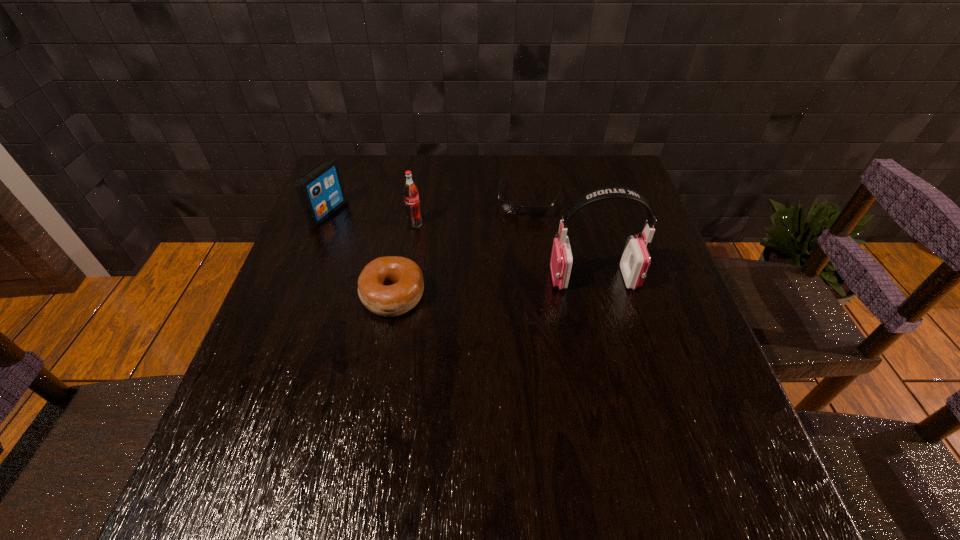
Identify which object is located as the nearest to the fourth tallest object. Please provide its 2D coordinates. Your answer should be formatted as a tuple, i.e. [(x, y)], where the tuple contains the x and y coordinates of a point satisfying the conditions above.

[(411, 197)]

The width and height of the screenshot is (960, 540). I want to click on object that stands as the closest to the soda bottle, so click(389, 286).

You are a GUI agent. You are given a task and a screenshot of the screen. Output one action in this format:
    pyautogui.click(x=<x>, y=<y>)
    Task: Click on the free location that satisfies the following two spatial constraints: 1. on the back side of the earphone; 2. on the outer surface of the bagel
    
    Given the screenshot: What is the action you would take?
    pyautogui.click(x=396, y=279)

What are the coordinates of `vacant space that satisfies the following two spatial constraints: 1. on the back side of the soda bottle; 2. on the right side of the shortest object` in the screenshot? It's located at (419, 200).

Identify the location of free space that satisfies the following two spatial constraints: 1. on the back side of the third shortest object; 2. on the left side of the sunglasses. (332, 200).